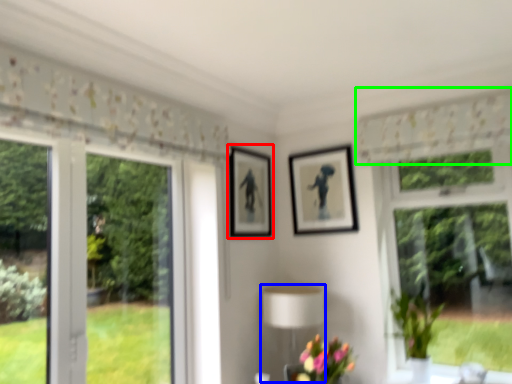
Question: Considering the real-world distances, which object is closest to picture frame (highlighted by a red box)? table lamp (highlighted by a blue box) or curtain (highlighted by a green box).

Choices:
 (A) table lamp
 (B) curtain

Answer: (A)